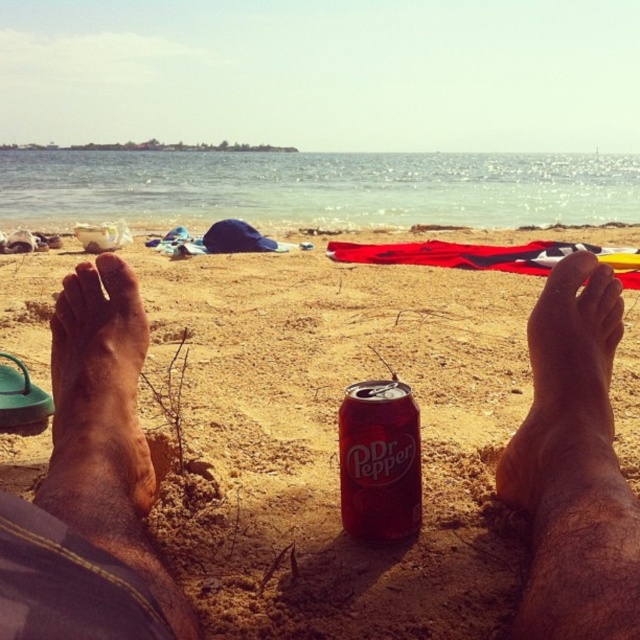
Question: Which point is farther to the camera?

Choices:
 (A) glossy aluminum can at center
 (B) dry skin foot at lower right
 (C) brown skin at center
 (D) smooth sand at feet center

Answer: (A)

Question: Can you confirm if smooth sand at feet center is bigger than brown skin at center?

Choices:
 (A) yes
 (B) no

Answer: (A)

Question: Is smooth sand at feet center to the left of dry skin foot at lower right from the viewer's perspective?

Choices:
 (A) no
 (B) yes

Answer: (B)

Question: Estimate the real-world distances between objects in this image. Which object is farther from the brown skin at center?

Choices:
 (A) glossy aluminum can at center
 (B) dry skin foot at lower right
 (C) smooth sand at feet center

Answer: (B)

Question: Can you confirm if smooth sand at feet center is bigger than dry skin foot at lower right?

Choices:
 (A) no
 (B) yes

Answer: (B)

Question: Which of the following is the farthest from the observer?

Choices:
 (A) 584,497
 (B) 36,608
 (C) 112,468
 (D) 353,509

Answer: (D)